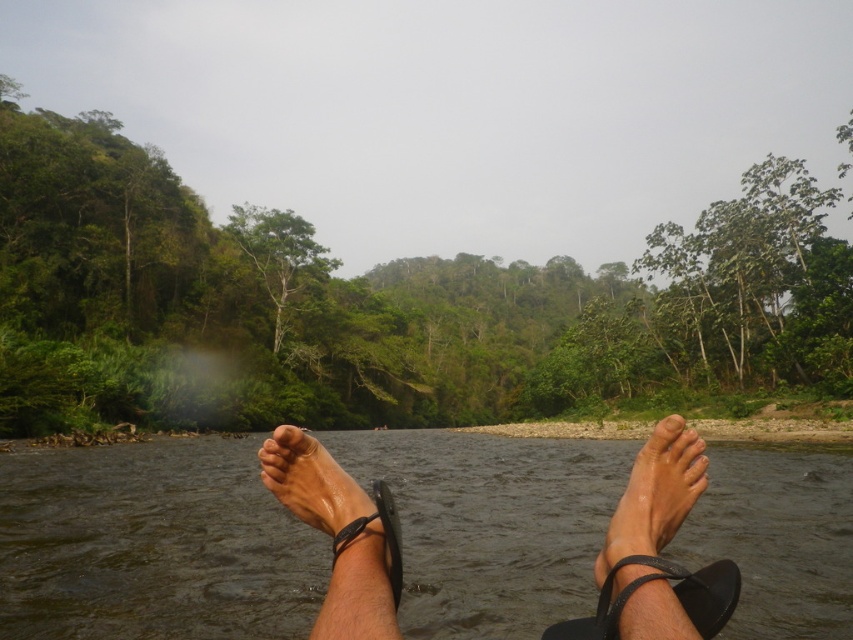
Which is in front, point (675, 426) or point (548, 636)?

Point (675, 426)

Between dry skin foot at lower center and black leather sandal at lower center, which one is positioned higher?

Positioned higher is black leather sandal at lower center.

Between point (665, 497) and point (596, 628), which one is positioned in front?

Point (596, 628)

Locate an element on the screen. dry skin foot at lower center is located at coordinates (654, 493).

What do you see at coordinates (335, 502) in the screenshot? This screenshot has width=853, height=640. I see `slick black flip-flop at lower center` at bounding box center [335, 502].

Locate an element on the screen. The height and width of the screenshot is (640, 853). slick black flip-flop at lower center is located at coordinates (335, 502).

Between slick black flip-flop at lower center and dry skin foot at lower center, which one is positioned higher?

slick black flip-flop at lower center

Does point (384, 548) come behind point (656, 433)?

No, it is not.

Identify the location of slick black flip-flop at lower center. (335, 502).